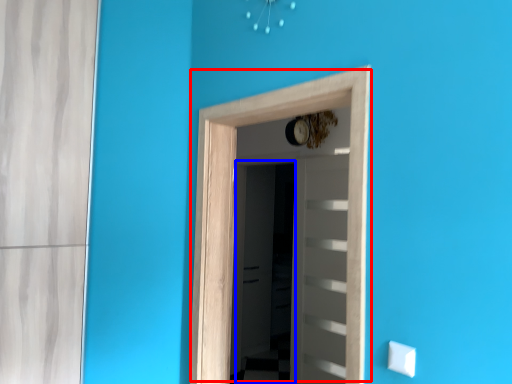
Question: Among these objects, which one is nearest to the camera, door (highlighted by a red box) or screen door (highlighted by a blue box)?

Choices:
 (A) door
 (B) screen door

Answer: (A)